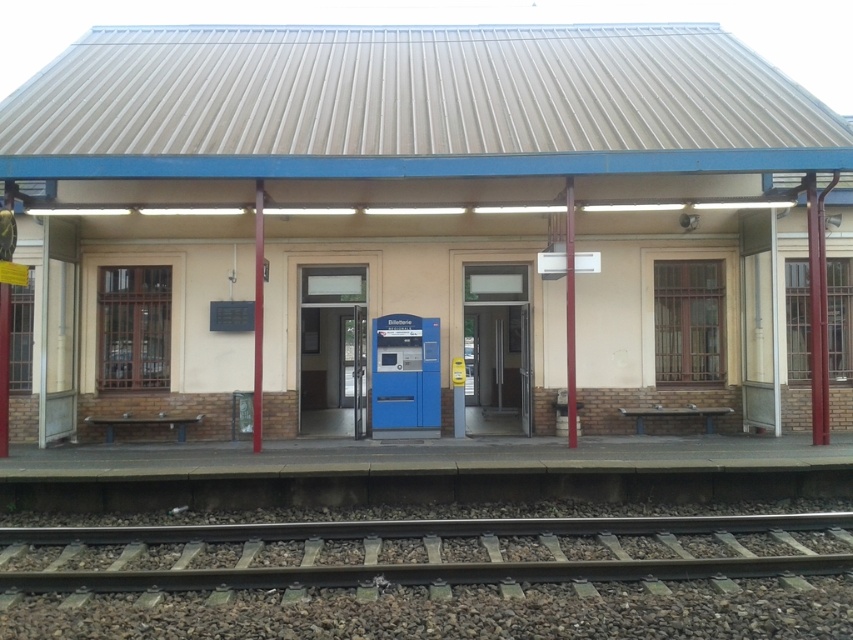
Question: Does beige concrete shed at center have a greater width compared to gray gravel train track at lower center?

Choices:
 (A) yes
 (B) no

Answer: (A)

Question: Is beige concrete shed at center above gray gravel train track at lower center?

Choices:
 (A) no
 (B) yes

Answer: (B)

Question: Among these points, which one is nearest to the camera?

Choices:
 (A) (302, 576)
 (B) (36, 132)

Answer: (A)

Question: Can you confirm if beige concrete shed at center is wider than gray gravel train track at lower center?

Choices:
 (A) yes
 (B) no

Answer: (A)